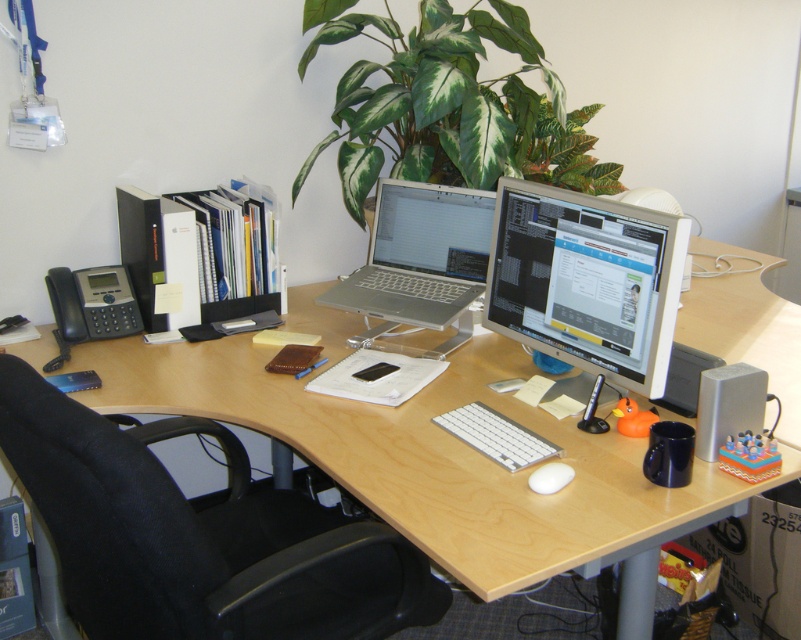
You are an office worker who needs to place a 10 cm tall paperweight on the desk. Considering the silver metallic monitor at center right and the silver metallic laptop at center, which surface would be more stable for placing the paperweight?

The silver metallic monitor at center right has a greater height compared to the silver metallic laptop at center, so placing the paperweight on the monitor would provide a more stable surface due to its higher elevation and sturdy base.

You are setting up a new desk arrangement and need to place a large plant between the silver metallic laptop at center and the white matte mouse at center. Considering their sizes, which object should the plant be closer to?

The plant should be closer to the silver metallic laptop at center because it is larger than the white matte mouse at center.